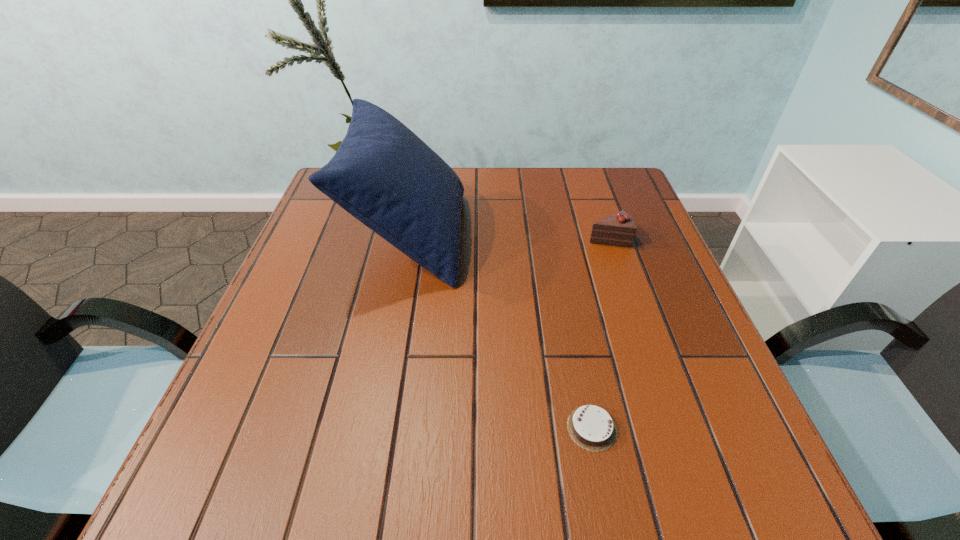
Identify the location of free space that satisfies the following two spatial constraints: 1. on the facing side of the farther chocolate cake; 2. on the right side of the cushion. The width and height of the screenshot is (960, 540). (409, 238).

At what (x,y) coordinates should I click in order to perform the action: click on free spot that satisfies the following two spatial constraints: 1. on the facing side of the left chocolate cake; 2. on the right side of the tallest object. Please return your answer as a coordinate pair (x, y). Looking at the image, I should click on (373, 428).

At what (x,y) coordinates should I click in order to perform the action: click on vacant region that satisfies the following two spatial constraints: 1. on the back side of the second object from left to right; 2. on the facing side of the tallest object. Please return your answer as a coordinate pair (x, y). The width and height of the screenshot is (960, 540). Looking at the image, I should click on pyautogui.click(x=554, y=236).

This screenshot has height=540, width=960. I want to click on vacant space that satisfies the following two spatial constraints: 1. on the facing side of the leftmost object; 2. on the back side of the right chocolate cake, so click(409, 238).